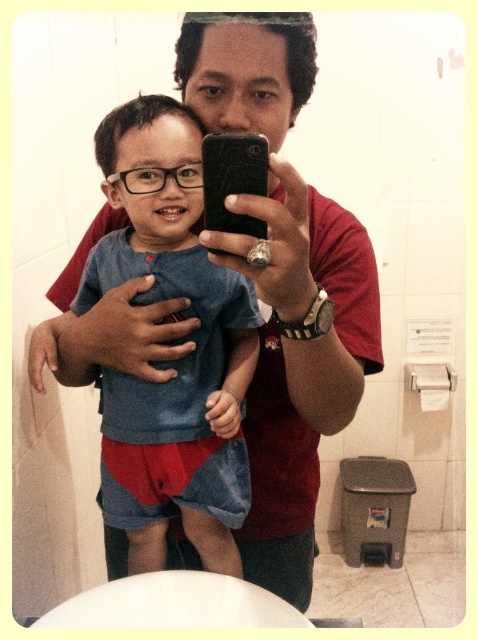
You are trying to take a selfie with the adult and the child. The adult is holding the black matte smartphone at center and the child is wearing the blue denim shorts at center. Since the adult wants to ensure the child is fully in the frame, which object should be positioned to the right to make sure the child is centered?

The black matte smartphone at center should be positioned to the right so that the blue denim shorts at center can be centered in the frame since the blue denim shorts at center is to the left of the black matte smartphone at center.

You are trying to take a photo of the blue denim shorts at center and the black matte smartphone at center. Based on their sizes, which object would appear bigger in the photo?

The blue denim shorts at center would appear bigger in the photo since it has a larger size compared to the black matte smartphone at center.